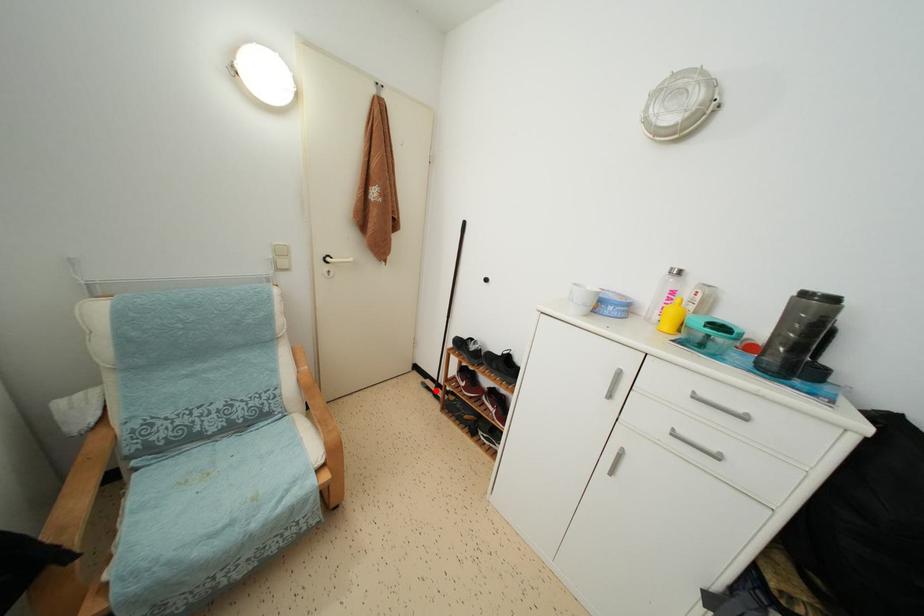
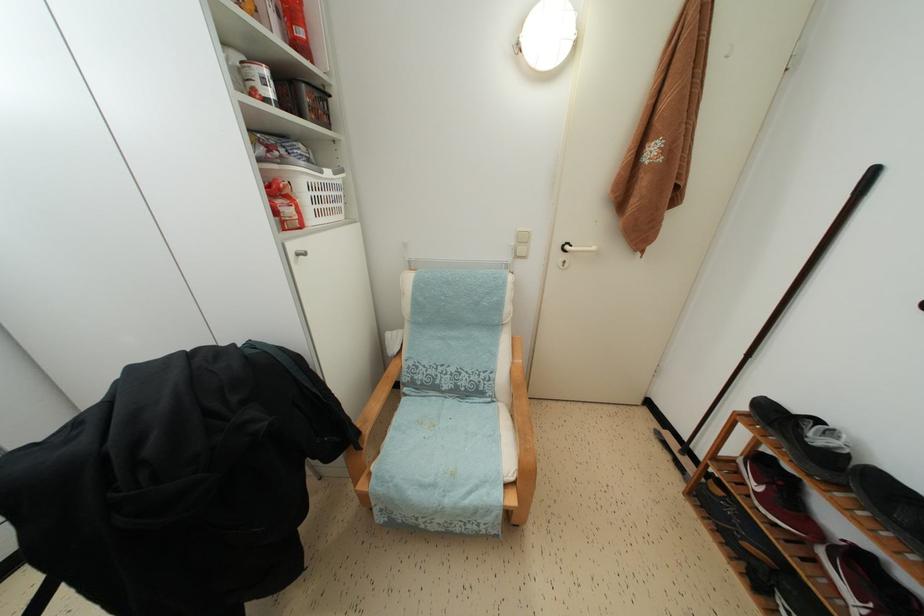
Question: I am providing you with two images of the same scene from different viewpoints. Image1 has a red point marked. In image2, the corresponding 3D location appears at what relative position? Reply with the corresponding letter.

Choices:
 (A) Closer
 (B) Farther

Answer: (A)